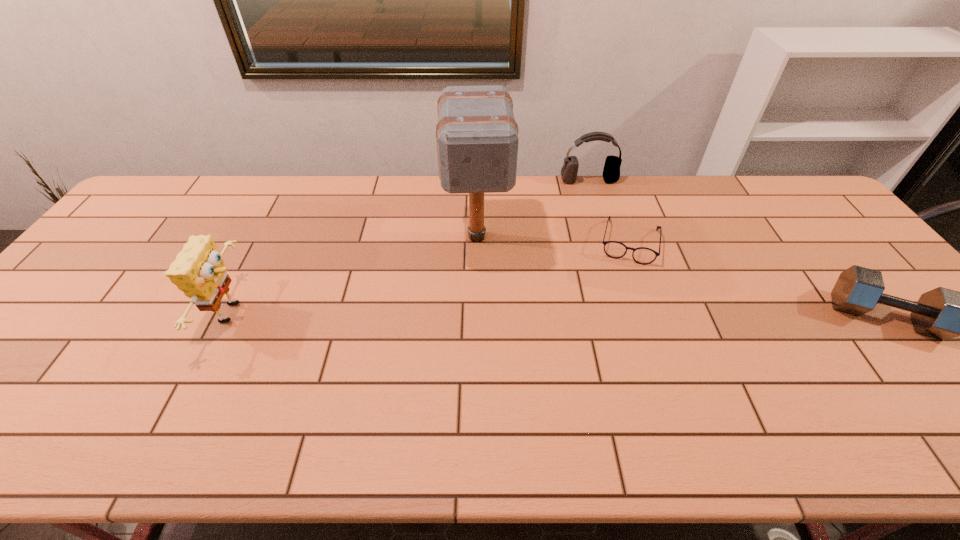
The image size is (960, 540). In order to click on vacant region located on the headband of the farthest object in this screenshot , I will do `click(616, 264)`.

You are a GUI agent. You are given a task and a screenshot of the screen. Output one action in this format:
    pyautogui.click(x=<x>, y=<y>)
    Task: Click on the blank space located 0.150m on the headband of the farthest object
    The image size is (960, 540).
    Given the screenshot: What is the action you would take?
    pyautogui.click(x=599, y=212)

You are a GUI agent. You are given a task and a screenshot of the screen. Output one action in this format:
    pyautogui.click(x=<x>, y=<y>)
    Task: Click on the free space located on the headband of the farthest object
    
    Given the screenshot: What is the action you would take?
    pyautogui.click(x=613, y=254)

Locate an element on the screen. Image resolution: width=960 pixels, height=540 pixels. free point located 0.270m on the striking surface of the tallest object is located at coordinates (482, 349).

Identify the location of free space located on the striking surface of the tallest object. (485, 398).

Locate an element on the screen. vacant point located 0.160m on the striking surface of the tallest object is located at coordinates (480, 313).

This screenshot has height=540, width=960. Identify the location of headset that is at the far edge. (611, 173).

Identify the location of mallet situated at the far edge. (477, 139).

I want to click on free space at the far edge of the desktop, so click(x=505, y=214).

Where is `vacant space at the left edge`? The height and width of the screenshot is (540, 960). vacant space at the left edge is located at coordinates (89, 334).